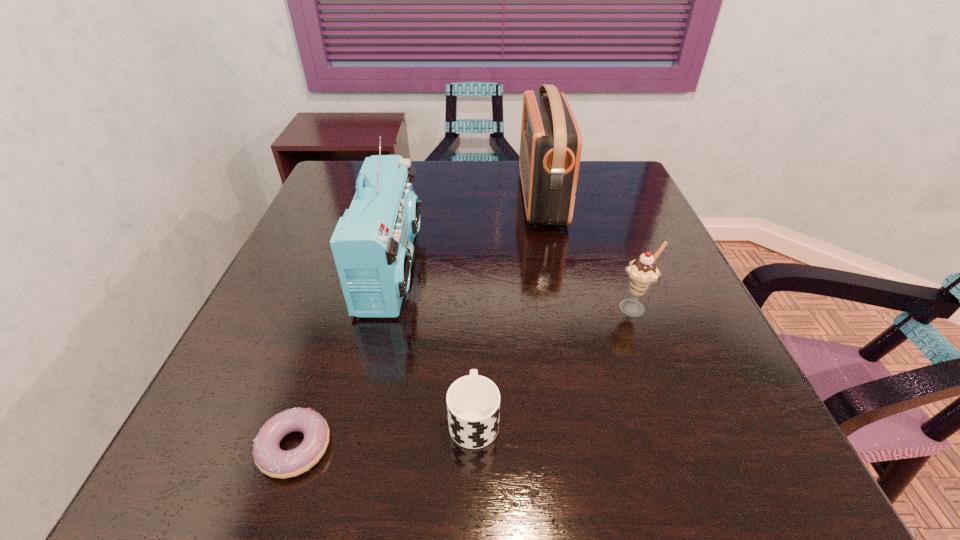
Find the location of `the right radio receiver`. the right radio receiver is located at coordinates (551, 143).

Find the location of a particular element. The height and width of the screenshot is (540, 960). the left radio receiver is located at coordinates (372, 245).

Where is `the rightmost object`? The width and height of the screenshot is (960, 540). the rightmost object is located at coordinates (642, 272).

Find the location of `icecream`. icecream is located at coordinates (642, 272).

You are a GUI agent. You are given a task and a screenshot of the screen. Output one action in this format:
    pyautogui.click(x=<x>, y=<y>)
    Task: Click on the fourth tallest object
    This screenshot has height=540, width=960.
    Given the screenshot: What is the action you would take?
    pyautogui.click(x=473, y=402)

Locate an element on the screen. The height and width of the screenshot is (540, 960). the third object from right to left is located at coordinates (473, 402).

This screenshot has height=540, width=960. What are the coordinates of `the shortest object` in the screenshot? It's located at tap(271, 460).

The width and height of the screenshot is (960, 540). What are the coordinates of `blank space located on the front-facing side of the second object from right to left` in the screenshot? It's located at (468, 197).

The image size is (960, 540). Identify the location of free space located 0.340m on the front-facing side of the second object from right to left. (401, 197).

Find the location of a particular element. This screenshot has width=960, height=540. free space located 0.380m on the front-facing side of the second object from right to left is located at coordinates (388, 197).